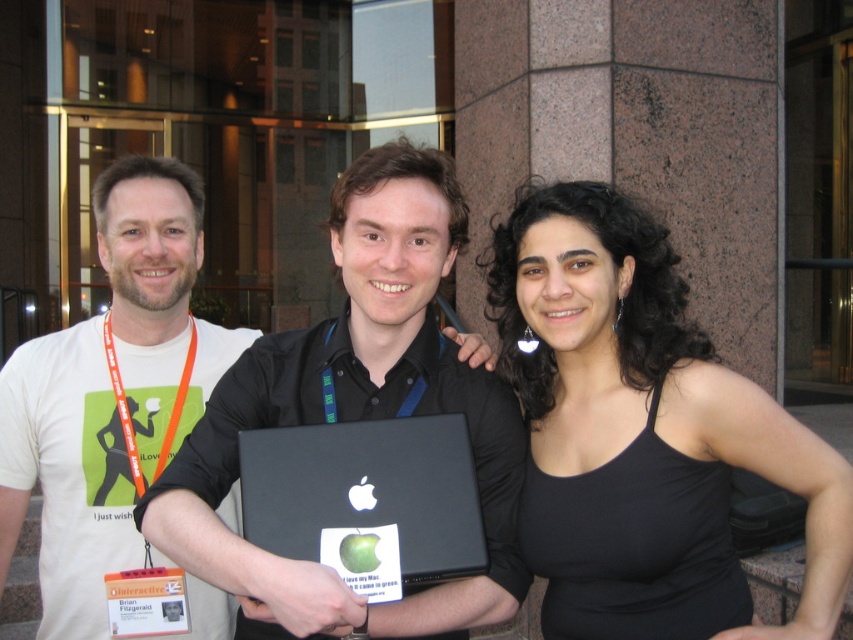
Does black matte tank top at center appear over black matte laptop at center?

Correct, black matte tank top at center is located above black matte laptop at center.

Does black matte tank top at center lie behind black matte laptop at center?

Yes.

Is point (535, 248) positioned before point (444, 474)?

No.

The image size is (853, 640). What are the coordinates of `black matte tank top at center` in the screenshot? It's located at pos(642,433).

Which is behind, point (0, 374) or point (398, 484)?

Point (0, 374)

The height and width of the screenshot is (640, 853). I want to click on white matte t-shirt at left, so click(109, 394).

What are the coordinates of `matte black laptop at center` in the screenshot? It's located at (355, 413).

Can you confirm if matte black laptop at center is shorter than black matte laptop at center?

Incorrect, matte black laptop at center's height does not fall short of black matte laptop at center's.

Which is behind, point (181, 545) or point (392, 577)?

Positioned behind is point (181, 545).

At what (x,y) coordinates should I click in order to perform the action: click on matte black laptop at center. Please return your answer as a coordinate pair (x, y). Image resolution: width=853 pixels, height=640 pixels. Looking at the image, I should click on (355, 413).